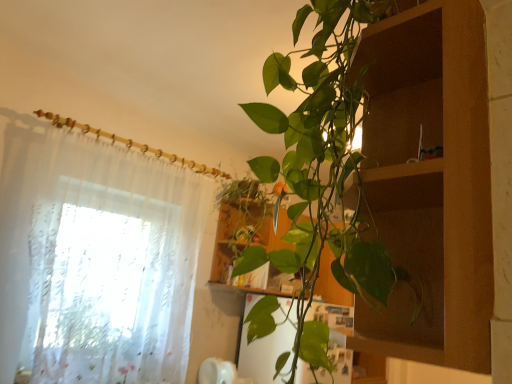
Find the location of a particular element. The height and width of the screenshot is (384, 512). wooden cabinet at center is located at coordinates (244, 242).

What do you see at coordinates (244, 242) in the screenshot?
I see `wooden cabinet at center` at bounding box center [244, 242].

What is the approximate width of wooden cabinet at center?

It is 12.05 inches.

Describe the element at coordinates (96, 261) in the screenshot. This screenshot has width=512, height=384. I see `sheer white curtain at left` at that location.

Locate an element on the screen. The image size is (512, 384). sheer white curtain at left is located at coordinates (96, 261).

Image resolution: width=512 pixels, height=384 pixels. Find the location of `wooden cabinet at center`. wooden cabinet at center is located at coordinates (244, 242).

Can you confirm if wooden cabinet at center is positioned to the right of sheer white curtain at left?

Yes.

Looking at this image, is wooden cabinet at center behind sheer white curtain at left?

Yes, wooden cabinet at center is further from the camera.

Which is in front, point (233, 232) or point (148, 332)?

The point (148, 332) is closer to the camera.

From the image's perspective, who appears lower, wooden cabinet at center or sheer white curtain at left?

From the image's view, wooden cabinet at center is below.

From a real-world perspective, is wooden cabinet at center physically located above or below sheer white curtain at left?

From a real-world perspective, wooden cabinet at center is physically above sheer white curtain at left.

Is wooden cabinet at center thinner than sheer white curtain at left?

Incorrect, the width of wooden cabinet at center is not less than that of sheer white curtain at left.

Who is shorter, wooden cabinet at center or sheer white curtain at left?

Standing shorter between the two is wooden cabinet at center.

Does wooden cabinet at center have a larger size compared to sheer white curtain at left?

Actually, wooden cabinet at center might be smaller than sheer white curtain at left.

Is wooden cabinet at center completely or partially outside of sheer white curtain at left?

Yes, wooden cabinet at center is located beyond the bounds of sheer white curtain at left.

Is wooden cabinet at center directly adjacent to sheer white curtain at left?

wooden cabinet at center and sheer white curtain at left are not in contact.

Is wooden cabinet at center turned away from sheer white curtain at left?

No, sheer white curtain at left is not at the back of wooden cabinet at center.

How many degrees apart are the facing directions of wooden cabinet at center and sheer white curtain at left?

They differ by 0.000228 degrees in their facing directions.

How much distance is there between wooden cabinet at center and sheer white curtain at left?

wooden cabinet at center is 35.07 inches from sheer white curtain at left.

The height and width of the screenshot is (384, 512). I want to click on curtain that is in front of the wooden cabinet at center, so click(96, 261).

Considering the positions of objects sheer white curtain at left and wooden cabinet at center in the image provided, who is more to the right, sheer white curtain at left or wooden cabinet at center?

From the viewer's perspective, wooden cabinet at center appears more on the right side.

Does sheer white curtain at left come behind wooden cabinet at center?

That is False.

Is point (19, 230) closer to camera compared to point (222, 268)?

Yes, it is in front of point (222, 268).

From the image's perspective, between sheer white curtain at left and wooden cabinet at center, who is located below?

wooden cabinet at center.

From a real-world perspective, is sheer white curtain at left under wooden cabinet at center?

Yes, from a real-world perspective, sheer white curtain at left is below wooden cabinet at center.

In terms of width, does sheer white curtain at left look wider or thinner when compared to wooden cabinet at center?

sheer white curtain at left is thinner than wooden cabinet at center.

Which of these two, sheer white curtain at left or wooden cabinet at center, stands shorter?

With less height is wooden cabinet at center.

Considering the sizes of objects sheer white curtain at left and wooden cabinet at center in the image provided, who is bigger, sheer white curtain at left or wooden cabinet at center?

sheer white curtain at left.

Is sheer white curtain at left not inside wooden cabinet at center?

That's correct, sheer white curtain at left is outside of wooden cabinet at center.

Would you consider sheer white curtain at left to be distant from wooden cabinet at center?

No, sheer white curtain at left is not far from wooden cabinet at center.

Is sheer white curtain at left positioned with its back to wooden cabinet at center?

sheer white curtain at left does not have its back to wooden cabinet at center.

Measure the distance between sheer white curtain at left and wooden cabinet at center.

sheer white curtain at left and wooden cabinet at center are 89.09 centimeters apart.

You are a GUI agent. You are given a task and a screenshot of the screen. Output one action in this format:
    pyautogui.click(x=<x>, y=<y>)
    Task: Click on the curtain in front of the wooden cabinet at center
    
    Given the screenshot: What is the action you would take?
    pyautogui.click(x=96, y=261)

The width and height of the screenshot is (512, 384). Identify the location of cabinet behind the sheer white curtain at left. (244, 242).

Locate an element on the screen. curtain that appears on the left of wooden cabinet at center is located at coordinates (96, 261).